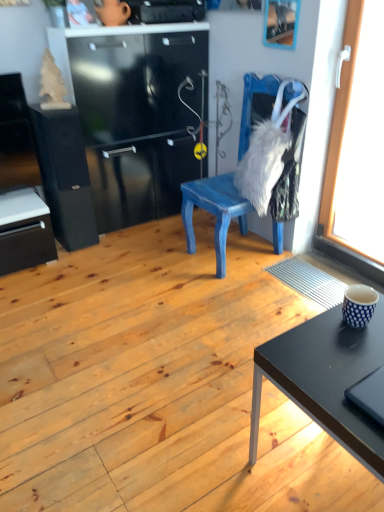
Locate an element on the screen. The height and width of the screenshot is (512, 384). free space in front of blue dotted cup at right is located at coordinates (355, 347).